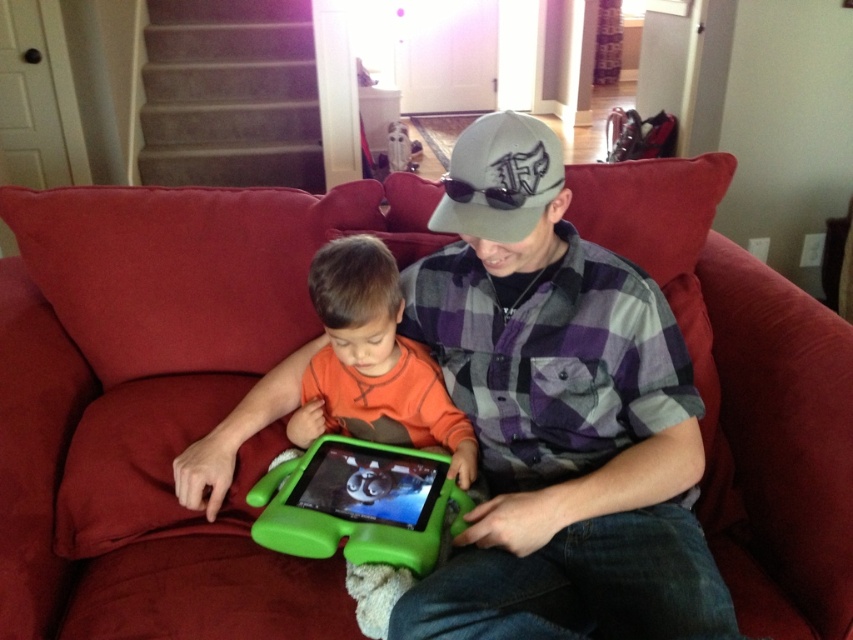
Can you confirm if orange soft shirt at center is positioned below gray fabric baseball cap at center?

Indeed, orange soft shirt at center is positioned under gray fabric baseball cap at center.

Is point (352, 262) closer to camera compared to point (491, 128)?

No, (352, 262) is behind (491, 128).

In order to click on orange soft shirt at center in this screenshot , I will do `click(374, 362)`.

Which of these two, orange soft shirt at center or green plastic tablet at center, stands shorter?

With less height is green plastic tablet at center.

Can you confirm if orange soft shirt at center is positioned above green plastic tablet at center?

Correct, orange soft shirt at center is located above green plastic tablet at center.

What do you see at coordinates (374, 362) in the screenshot? I see `orange soft shirt at center` at bounding box center [374, 362].

Where is `orange soft shirt at center`? The height and width of the screenshot is (640, 853). orange soft shirt at center is located at coordinates (374, 362).

Which of these two, gray fabric baseball cap at center or green plastic tablet at center, stands taller?

gray fabric baseball cap at center is taller.

Does point (500, 124) come in front of point (381, 460)?

Yes, it is.

Where is `gray fabric baseball cap at center`? This screenshot has width=853, height=640. gray fabric baseball cap at center is located at coordinates (498, 177).